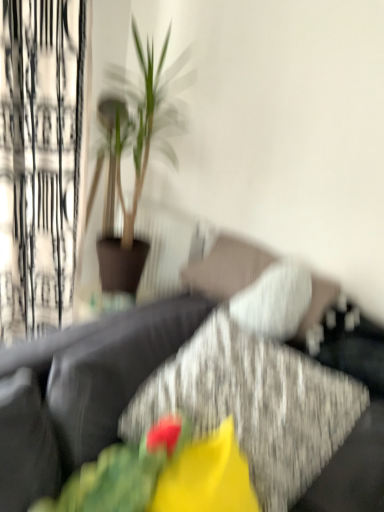
Question: From a real-world perspective, is textured gray couch at center physically located above or below green leafy plant at upper left?

Choices:
 (A) above
 (B) below

Answer: (B)

Question: Do you think textured gray couch at center is within green leafy plant at upper left, or outside of it?

Choices:
 (A) outside
 (B) inside

Answer: (A)

Question: Which is nearer to the matte yellow flower at center?

Choices:
 (A) textured gray couch at center
 (B) fluffy fabric flower at center
 (C) green leafy plant at upper left
 (D) white sheer curtain at left

Answer: (B)

Question: Based on their relative distances, which object is nearer to the white sheer curtain at left?

Choices:
 (A) fluffy fabric flower at center
 (B) green leafy plant at upper left
 (C) matte yellow flower at center
 (D) textured gray couch at center

Answer: (B)